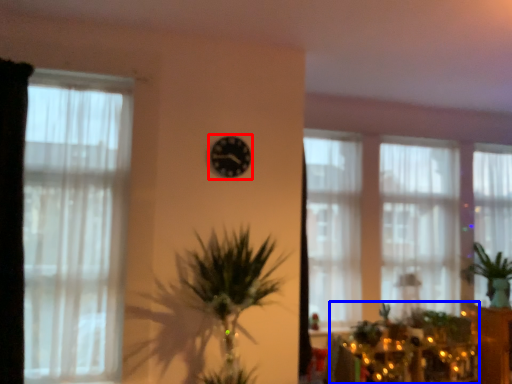
Question: Which of the following is the closest to the observer, clock (highlighted by a red box) or christmas decoration (highlighted by a blue box)?

Choices:
 (A) clock
 (B) christmas decoration

Answer: (A)